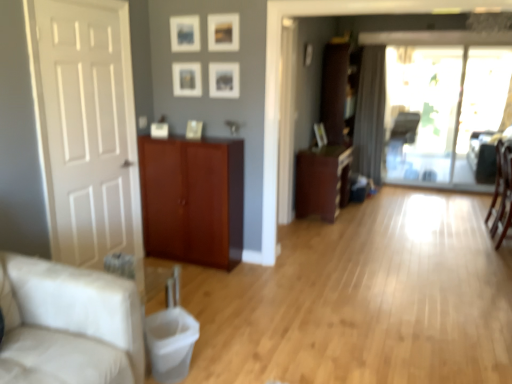
Question: In the image, is beige fabric couch at left on the left side or the right side of mahogany wood cabinet at center, which is the third cabinetry from right to left?

Choices:
 (A) left
 (B) right

Answer: (A)

Question: From the image's perspective, relative to mahogany wood cabinet at center, which is the third cabinetry from right to left, is beige fabric couch at left above or below?

Choices:
 (A) below
 (B) above

Answer: (A)

Question: Which is nearer to the wooden chair at right?

Choices:
 (A) matte wood cabinet at center, the 2th cabinetry when ordered from right to left
 (B) beige fabric couch at left
 (C) gray fabric curtain at center
 (D) mahogany wood cabinet at center, which appears as the 1th cabinetry when viewed from the front
 (E) matte black armchair at center

Answer: (A)

Question: Which object is positioned farthest from the beige fabric couch at left?

Choices:
 (A) gray fabric curtain at center
 (B) mahogany wood cabinet at center, which appears as the 1th cabinetry when viewed from the front
 (C) transparent glass door at center
 (D) brown wood cabinet at center, marked as the 1th cabinetry in a right-to-left arrangement
 (E) matte black armchair at center

Answer: (C)